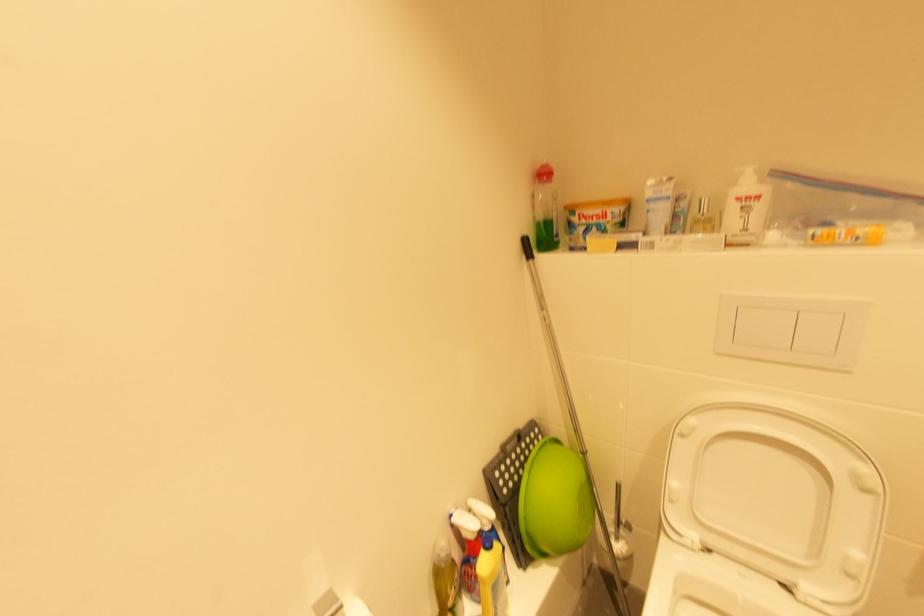
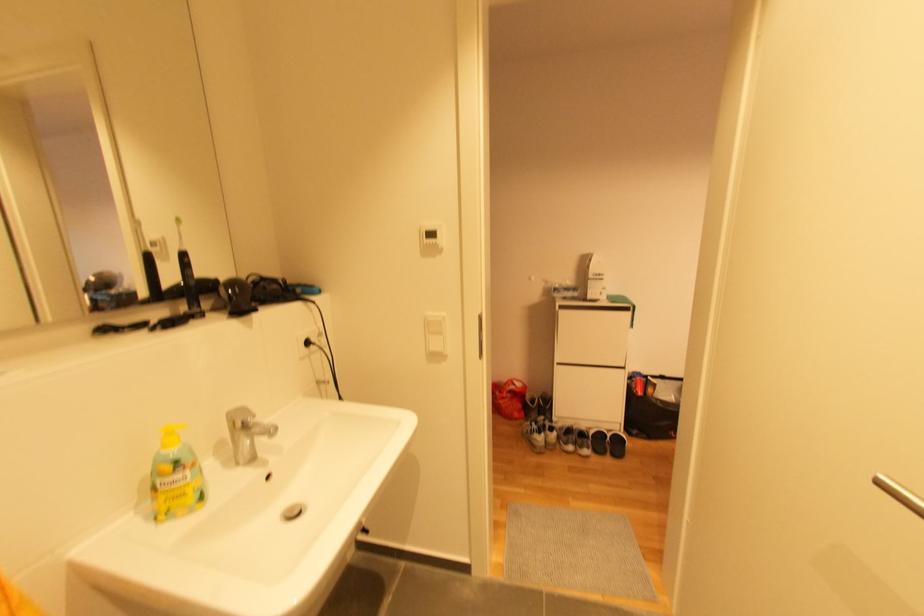
Question: Based on the continuous images, in which direction is the camera rotating? Reply with the corresponding letter.

Choices:
 (A) Left
 (B) Right
 (C) Up
 (D) Down

Answer: (B)